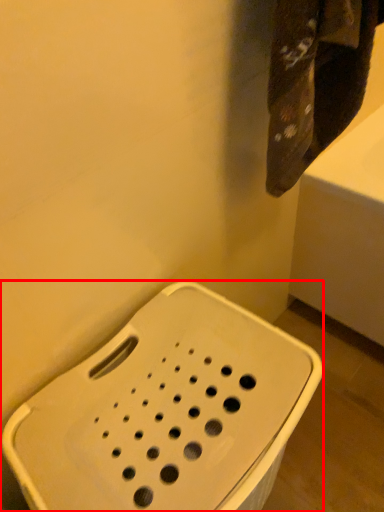
Question: From the image's perspective, where is porcelain (annotated by the red box) located relative to towel?

Choices:
 (A) above
 (B) below

Answer: (B)